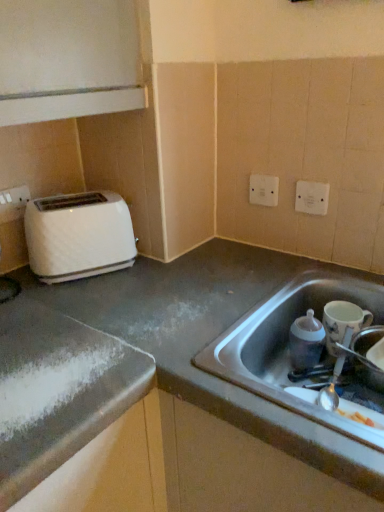
The image size is (384, 512). I want to click on white plastic toaster at left, so click(78, 236).

This screenshot has height=512, width=384. What do you see at coordinates (78, 236) in the screenshot?
I see `white plastic toaster at left` at bounding box center [78, 236].

Find the location of `stainless steel sink at lower right`. stainless steel sink at lower right is located at coordinates (287, 345).

Locate an element on the screen. white plastic electric outlet at upper center, the 2th electric outlet viewed from the right is located at coordinates (263, 190).

Looking at this image, in order to face smooth gray countertop at lower right, should I rotate leftwards or rightwards?

You should look right and rotate roughly 1.992 degrees.

Identify the location of white glossy cup at lower right, marked as the first appliance in a right-to-left arrangement. The width and height of the screenshot is (384, 512). tap(365, 356).

In the scene shown: In terms of height, does white plastic toaster at left look taller or shorter compared to matte plastic baby bottle at sink, arranged as the third appliance when viewed from the right?

In the image, white plastic toaster at left appears to be taller than matte plastic baby bottle at sink, arranged as the third appliance when viewed from the right.

Consider the image. In the image, is white plastic toaster at left positioned in front of or behind matte plastic baby bottle at sink, arranged as the third appliance when viewed from the right?

white plastic toaster at left is behind matte plastic baby bottle at sink, arranged as the third appliance when viewed from the right.

In the scene shown: Is white plastic toaster at left bigger or smaller than matte plastic baby bottle at sink, arranged as the third appliance when viewed from the right?

Considering their sizes, white plastic toaster at left takes up more space than matte plastic baby bottle at sink, arranged as the third appliance when viewed from the right.

Measure the distance from white plastic toaster at left to matte plastic baby bottle at sink, arranged as the third appliance when viewed from the right.

white plastic toaster at left is 21.37 inches away from matte plastic baby bottle at sink, arranged as the third appliance when viewed from the right.

Does point (33, 223) appear closer or farther from the camera than point (363, 378)?

Point (33, 223).

Is white plastic toaster at left positioned behind white glossy cup at lower right, which ranks as the third appliance in left-to-right order?

Yes, white plastic toaster at left is further from the viewer.

Would you say white plastic toaster at left is inside or outside white glossy cup at lower right, which ranks as the third appliance in left-to-right order?

white plastic toaster at left is spatially situated outside white glossy cup at lower right, which ranks as the third appliance in left-to-right order.

Do you think white plastic electric outlet at upper center, placed as the second electric outlet when sorted from front to back, is within white glossy cup at lower right, which ranks as the third appliance in left-to-right order, or outside of it?

white plastic electric outlet at upper center, placed as the second electric outlet when sorted from front to back, lies outside white glossy cup at lower right, which ranks as the third appliance in left-to-right order.

Is white plastic electric outlet at upper center, which is counted as the 1th electric outlet, starting from the left, not near white glossy cup at lower right, which ranks as the third appliance in left-to-right order?

No, white plastic electric outlet at upper center, which is counted as the 1th electric outlet, starting from the left, is not far from white glossy cup at lower right, which ranks as the third appliance in left-to-right order.

Considering the relative positions of white plastic electric outlet at upper center, placed as the second electric outlet when sorted from front to back, and white glossy cup at lower right, marked as the first appliance in a right-to-left arrangement, in the image provided, is white plastic electric outlet at upper center, placed as the second electric outlet when sorted from front to back, to the left of white glossy cup at lower right, marked as the first appliance in a right-to-left arrangement, from the viewer's perspective?

Correct, you'll find white plastic electric outlet at upper center, placed as the second electric outlet when sorted from front to back, to the left of white glossy cup at lower right, marked as the first appliance in a right-to-left arrangement.

In terms of size, does white plastic electric outlet at upper center, which appears as the 1th electric outlet when viewed from the back, appear bigger or smaller than white glossy cup at lower right, which ranks as the third appliance in left-to-right order?

In the image, white plastic electric outlet at upper center, which appears as the 1th electric outlet when viewed from the back, appears to be smaller than white glossy cup at lower right, which ranks as the third appliance in left-to-right order.

Is white glossy mug at right, which ranks as the second appliance in right-to-left order, facing towards smooth gray countertop at lower right?

Yes, white glossy mug at right, which ranks as the second appliance in right-to-left order, is aimed at smooth gray countertop at lower right.

From the image's perspective, between white glossy mug at right, placed as the 2th appliance when sorted from left to right, and smooth gray countertop at lower right, who is located below?

smooth gray countertop at lower right.

Which is closer to the camera, (x=344, y=311) or (x=60, y=311)?

The point (x=60, y=311) is more forward.

Find the location of `electric outlet on the right of matte plastic baby bottle at sink, arranged as the third appliance when viewed from the right`. electric outlet on the right of matte plastic baby bottle at sink, arranged as the third appliance when viewed from the right is located at coordinates (312, 197).

Is there a large distance between matte plastic baby bottle at sink, arranged as the third appliance when viewed from the right, and white plastic electric outlet at upper right, acting as the second electric outlet starting from the left?

They are positioned close to each other.

Considering the sizes of objects matte plastic baby bottle at sink, the first appliance in the left-to-right sequence, and white plastic electric outlet at upper right, the 2th electric outlet positioned from the back, in the image provided, who is smaller, matte plastic baby bottle at sink, the first appliance in the left-to-right sequence, or white plastic electric outlet at upper right, the 2th electric outlet positioned from the back,?

Smaller between the two is white plastic electric outlet at upper right, the 2th electric outlet positioned from the back.

Is matte plastic baby bottle at sink, the first appliance in the left-to-right sequence, aimed at white plastic electric outlet at upper right, the first electric outlet from the right?

No, matte plastic baby bottle at sink, the first appliance in the left-to-right sequence, does not turn towards white plastic electric outlet at upper right, the first electric outlet from the right.

Considering the sizes of objects smooth gray countertop at lower right and white glossy mug at right, placed as the 2th appliance when sorted from left to right, in the image provided, who is bigger, smooth gray countertop at lower right or white glossy mug at right, placed as the 2th appliance when sorted from left to right,?

Bigger between the two is smooth gray countertop at lower right.

From a real-world perspective, between smooth gray countertop at lower right and white glossy mug at right, placed as the 2th appliance when sorted from left to right, who is vertically higher?

white glossy mug at right, placed as the 2th appliance when sorted from left to right, is physically above.

From the image's perspective, is smooth gray countertop at lower right positioned above or below white glossy mug at right, placed as the 2th appliance when sorted from left to right?

Clearly, from the image's perspective, smooth gray countertop at lower right is below white glossy mug at right, placed as the 2th appliance when sorted from left to right.

Is smooth gray countertop at lower right directly adjacent to white glossy mug at right, which ranks as the second appliance in right-to-left order?

smooth gray countertop at lower right and white glossy mug at right, which ranks as the second appliance in right-to-left order, are clearly separated.

From the image's perspective, is smooth gray countertop at lower right located beneath white glossy cup at lower right, which ranks as the third appliance in left-to-right order?

Yes, from the image's perspective, smooth gray countertop at lower right is below white glossy cup at lower right, which ranks as the third appliance in left-to-right order.

Is smooth gray countertop at lower right facing towards white glossy cup at lower right, which ranks as the third appliance in left-to-right order?

No, smooth gray countertop at lower right is not turned towards white glossy cup at lower right, which ranks as the third appliance in left-to-right order.

Which of these two, smooth gray countertop at lower right or white glossy cup at lower right, marked as the first appliance in a right-to-left arrangement, stands taller?

smooth gray countertop at lower right.

Is smooth gray countertop at lower right smaller than white glossy cup at lower right, marked as the first appliance in a right-to-left arrangement?

Actually, smooth gray countertop at lower right might be larger than white glossy cup at lower right, marked as the first appliance in a right-to-left arrangement.

Where is `toaster above the matte plastic baby bottle at sink, arranged as the third appliance when viewed from the right (from the image's perspective)`? This screenshot has height=512, width=384. toaster above the matte plastic baby bottle at sink, arranged as the third appliance when viewed from the right (from the image's perspective) is located at coordinates (78, 236).

There is a white plastic toaster at left. In order to click on the 3rd appliance below it (from a real-world perspective) in this screenshot , I will do `click(365, 356)`.

Consider the image. Considering their positions, is matte plastic baby bottle at sink, the first appliance in the left-to-right sequence, positioned closer to white glossy cup at lower right, which ranks as the third appliance in left-to-right order, than smooth gray countertop at lower right?

matte plastic baby bottle at sink, the first appliance in the left-to-right sequence, is closer to white glossy cup at lower right, which ranks as the third appliance in left-to-right order.

Which object lies further to the anchor point white glossy cup at lower right, which ranks as the third appliance in left-to-right order, white plastic toaster at left or white glossy mug at right, placed as the 2th appliance when sorted from left to right?

Among the two, white plastic toaster at left is located further to white glossy cup at lower right, which ranks as the third appliance in left-to-right order.

When comparing their distances from white glossy mug at right, placed as the 2th appliance when sorted from left to right, does white plastic toaster at left or white glossy cup at lower right, marked as the first appliance in a right-to-left arrangement, seem further?

Among the two, white plastic toaster at left is located further to white glossy mug at right, placed as the 2th appliance when sorted from left to right.

Based on their spatial positions, is white plastic electric outlet at upper right, acting as the second electric outlet starting from the left, or smooth gray countertop at lower right closer to matte plastic baby bottle at sink, the first appliance in the left-to-right sequence?

smooth gray countertop at lower right.

Which object lies nearer to the anchor point white plastic toaster at left, white glossy cup at lower right, which ranks as the third appliance in left-to-right order, or stainless steel sink at lower right?

stainless steel sink at lower right.

Looking at this image, when comparing their distances from white plastic toaster at left, does white plastic electric outlet at upper center, which is counted as the 1th electric outlet, starting from the left, or white plastic electric outlet at upper right, the first electric outlet from the front, seem further?

white plastic electric outlet at upper right, the first electric outlet from the front, is positioned further to the anchor white plastic toaster at left.

Considering their positions, is matte plastic baby bottle at sink, arranged as the third appliance when viewed from the right, positioned further to white glossy cup at lower right, which ranks as the third appliance in left-to-right order, than white plastic electric outlet at upper center, the 2th electric outlet viewed from the right?

white plastic electric outlet at upper center, the 2th electric outlet viewed from the right, is positioned further to the anchor white glossy cup at lower right, which ranks as the third appliance in left-to-right order.

From the image, which object appears to be farther from smooth gray countertop at lower right, white plastic electric outlet at upper right, the first electric outlet from the right, or stainless steel sink at lower right?

white plastic electric outlet at upper right, the first electric outlet from the right.

This screenshot has height=512, width=384. What are the coordinates of `electric outlet between white plastic toaster at left and matte plastic baby bottle at sink, arranged as the third appliance when viewed from the right, in the horizontal direction` in the screenshot? It's located at (263, 190).

At what (x,y) coordinates should I click in order to perform the action: click on sink between white plastic toaster at left and white glossy mug at right, placed as the 2th appliance when sorted from left to right, in the horizontal direction. Please return your answer as a coordinate pair (x, y). Looking at the image, I should click on (287, 345).

This screenshot has height=512, width=384. What are the coordinates of `sink between smooth gray countertop at lower right and white glossy mug at right, which ranks as the second appliance in right-to-left order, along the z-axis` in the screenshot? It's located at (287, 345).

You are a GUI agent. You are given a task and a screenshot of the screen. Output one action in this format:
    pyautogui.click(x=<x>, y=<y>)
    Task: Click on the toaster between white plastic electric outlet at upper center, which is counted as the 1th electric outlet, starting from the left, and smooth gray countertop at lower right in the up-down direction
    The image size is (384, 512).
    Given the screenshot: What is the action you would take?
    pyautogui.click(x=78, y=236)